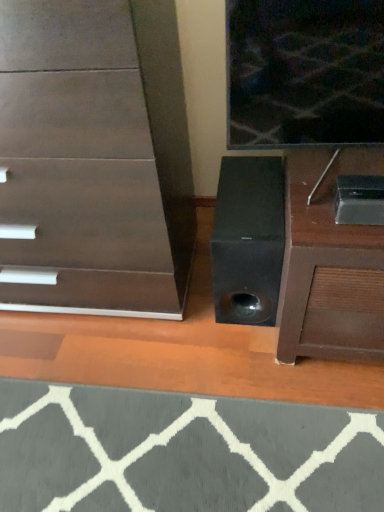
Question: Is point (208, 446) closer or farther from the camera than point (360, 322)?

Choices:
 (A) closer
 (B) farther

Answer: (B)

Question: From a real-world perspective, relative to metallic silver speaker at lower right, is gray woolen doormat at lower center vertically above or below?

Choices:
 (A) below
 (B) above

Answer: (A)

Question: Which of these objects is positioned closest to the gray woolen doormat at lower center?

Choices:
 (A) dark wood chest of drawers at center
 (B) metallic silver speaker at lower right

Answer: (B)

Question: Which is farther from the gray woolen doormat at lower center?

Choices:
 (A) dark wood chest of drawers at center
 (B) metallic silver speaker at lower right

Answer: (A)